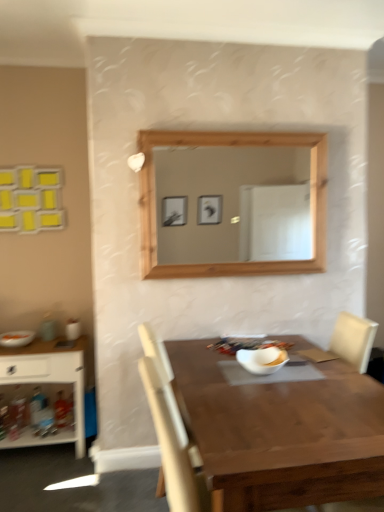
Locate an element on the screen. vacant region to the left of white glossy bowl at center is located at coordinates click(213, 372).